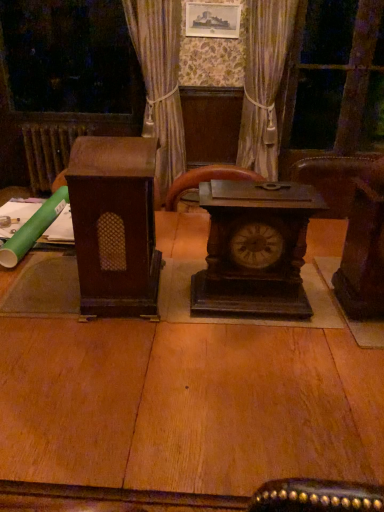
Identify the location of vacant area that lies in front of brown wood speaker at left, the 1th furniture viewed from the left. (115, 342).